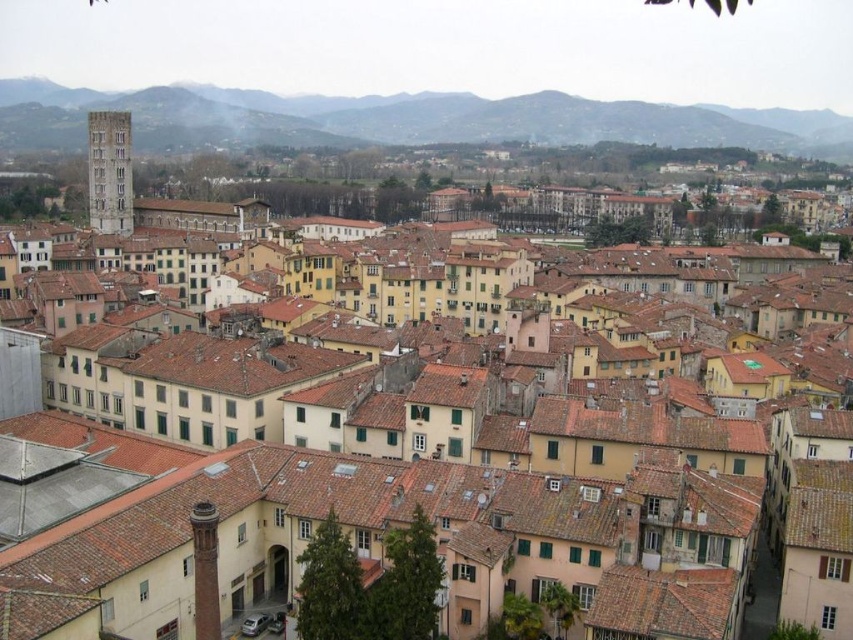
You are an architect visiting this historic town and want to assess the elevation differences between the brown grassy hillside at upper center and the smooth stone tower at left. Which one has a greater height?

The smooth stone tower at left has a greater height than the brown grassy hillside at upper center.

You are standing at the point marked by coordinates (451,116) in the image. What is the immediate terrain feature you are standing on?

The immediate terrain feature at point (451,116) is a brown grassy hillside at upper center.

You are a tourist standing in the town square and want to take a photo that includes both the brown grassy hillside at upper center and the smooth stone tower at left. Which object should you position closer to the edge of your camera frame to ensure both fit in the shot?

You should position the smooth stone tower at left closer to the edge of your camera frame because the brown grassy hillside at upper center is larger in size than the smooth stone tower at left, so it will take up more space in the photo.